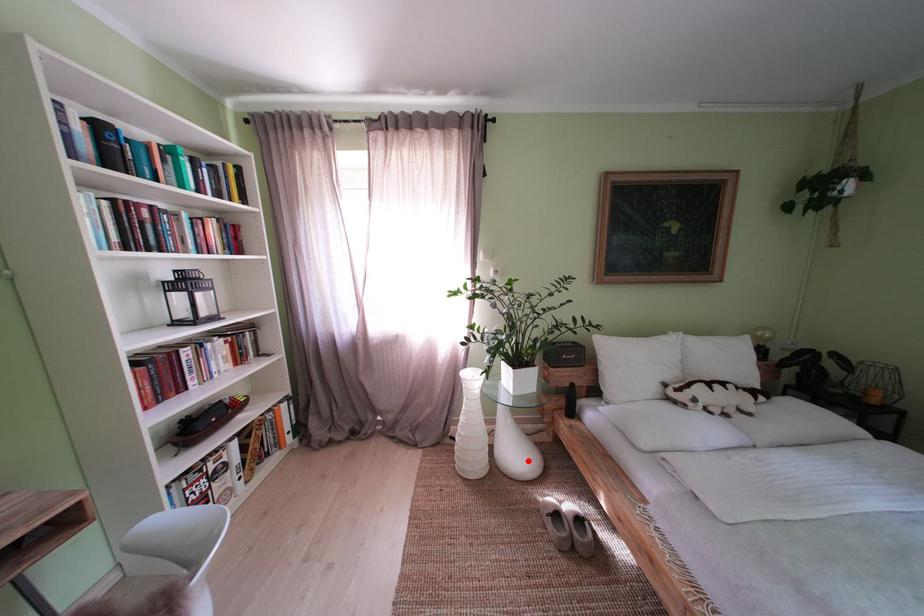
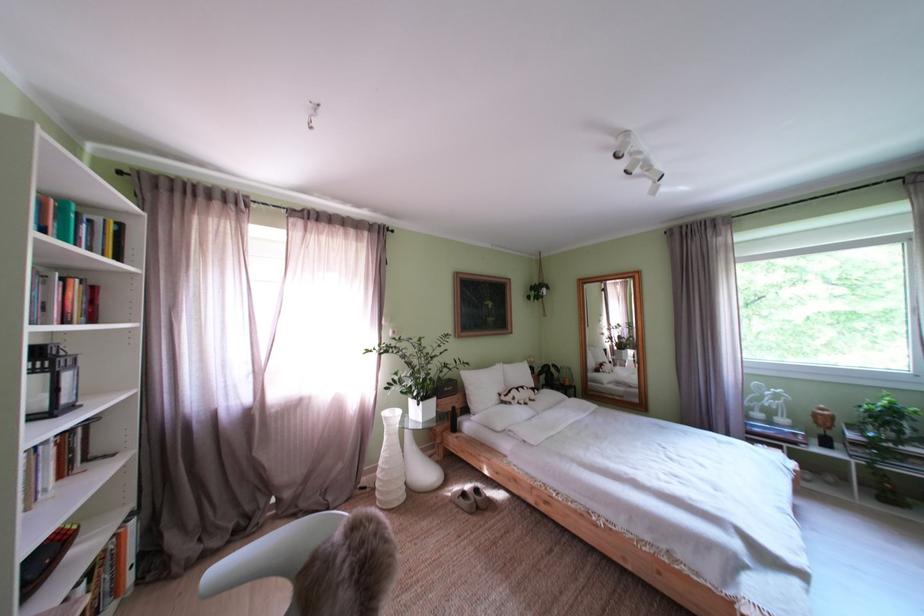
Question: I am providing you with two images of the same scene from different viewpoints. Given a red point in image1, look at the same physical point in image2. Is it:

Choices:
 (A) Closer to the viewpoint
 (B) Farther from the viewpoint

Answer: (B)